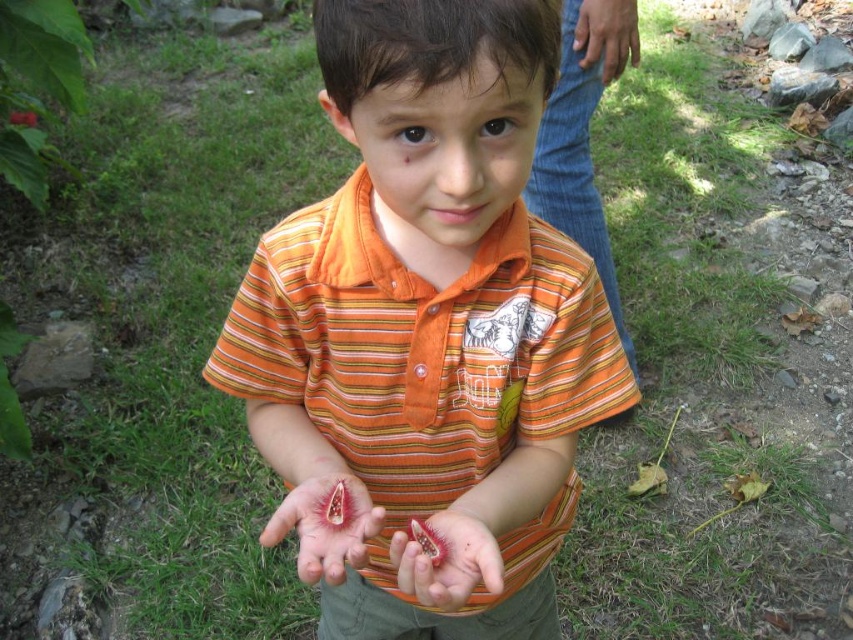
Question: Which of the following is the farthest from the observer?

Choices:
 (A) (474, 508)
 (B) (605, 42)
 (C) (305, 516)
 (D) (486, 220)

Answer: (B)

Question: Can you confirm if pink flesh at center is bigger than brown leather hand at upper right?

Choices:
 (A) no
 (B) yes

Answer: (A)

Question: Does fleshy pinkish-red at center have a larger size compared to pink flesh at center?

Choices:
 (A) no
 (B) yes

Answer: (B)

Question: Which point is closer to the camera?

Choices:
 (A) brown leather hand at upper right
 (B) pink flesh at center
 (C) orange striped shirt at center

Answer: (C)

Question: Which point is farther to the camera?

Choices:
 (A) brown leather hand at upper right
 (B) orange striped shirt at center
 (C) fleshy pinkish-red at center
 (D) pink flesh at center

Answer: (A)

Question: Is orange striped shirt at center positioned in front of fleshy pinkish-red at center?

Choices:
 (A) yes
 (B) no

Answer: (A)